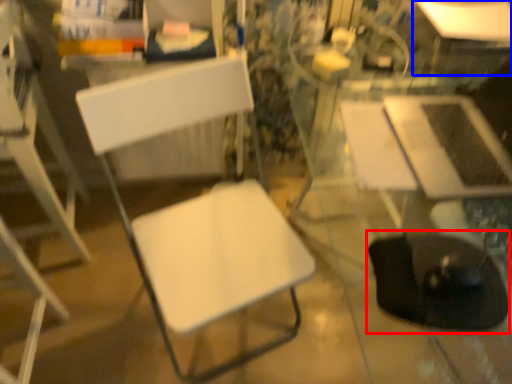
Question: Which object is further to the camera taking this photo, swivel chair (highlighted by a red box) or table (highlighted by a blue box)?

Choices:
 (A) swivel chair
 (B) table

Answer: (B)